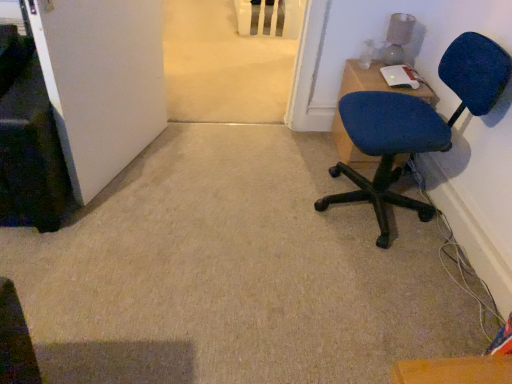
Locate an element on the screen. Image resolution: width=512 pixels, height=384 pixels. free space in front of white matte door at lower left is located at coordinates (115, 230).